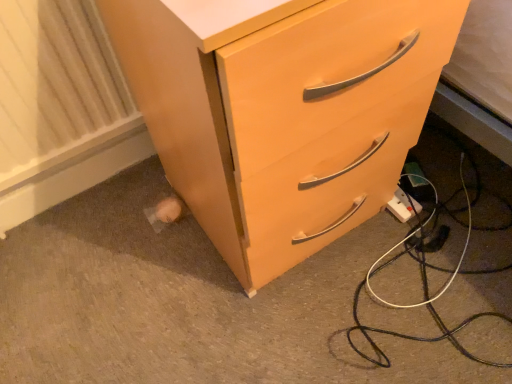
The image size is (512, 384). Describe the element at coordinates (282, 111) in the screenshot. I see `matte wood chest of drawers at center` at that location.

Image resolution: width=512 pixels, height=384 pixels. Find the location of `matte wood chest of drawers at center`. matte wood chest of drawers at center is located at coordinates (282, 111).

This screenshot has height=384, width=512. What are the coordinates of `white plastic power strip at lower right` in the screenshot? It's located at (403, 206).

Consider the image. Is white plastic power strip at lower right facing away from matte wood chest of drawers at center?

No.

Based on the photo, from a real-world perspective, who is located lower, white plastic power strip at lower right or matte wood chest of drawers at center?

white plastic power strip at lower right is physically lower.

Which object is positioned more to the left, white plastic power strip at lower right or matte wood chest of drawers at center?

matte wood chest of drawers at center is more to the left.

Does point (405, 197) lie in front of point (333, 14)?

No, (405, 197) is further to viewer.

Could you tell me if matte wood chest of drawers at center is facing white plastic power strip at lower right?

No.

Can you tell me how much matte wood chest of drawers at center and white plastic power strip at lower right differ in facing direction?

They differ by 0.0619 degrees in their facing directions.

Does matte wood chest of drawers at center lie behind white plastic power strip at lower right?

No, it is not.

Would you say white textured radiator at lower left is to the left or to the right of white plastic power strip at lower right in the picture?

Based on their positions, white textured radiator at lower left is located to the left of white plastic power strip at lower right.

Who is more distant, white textured radiator at lower left or white plastic power strip at lower right?

white plastic power strip at lower right is further from the camera.

Are white textured radiator at lower left and white plastic power strip at lower right beside each other?

No, white textured radiator at lower left is not in contact with white plastic power strip at lower right.

Is the surface of white textured radiator at lower left in direct contact with matte wood chest of drawers at center?

No, white textured radiator at lower left is not beside matte wood chest of drawers at center.

Consider the image. Does white textured radiator at lower left appear on the left side of matte wood chest of drawers at center?

Yes.

In the scene shown: Is matte wood chest of drawers at center located within white textured radiator at lower left?

No, matte wood chest of drawers at center is located outside of white textured radiator at lower left.

From the image's perspective, is white textured radiator at lower left located above or below matte wood chest of drawers at center?

white textured radiator at lower left is below matte wood chest of drawers at center.

Is matte wood chest of drawers at center in contact with white textured radiator at lower left?

No, matte wood chest of drawers at center is not making contact with white textured radiator at lower left.

Is matte wood chest of drawers at center spatially inside white textured radiator at lower left, or outside of it?

matte wood chest of drawers at center is outside white textured radiator at lower left.

From a real-world perspective, is matte wood chest of drawers at center physically above white textured radiator at lower left?

Yes, from a real-world perspective, matte wood chest of drawers at center is over white textured radiator at lower left

From the picture: Are white plastic power strip at lower right and white textured radiator at lower left beside each other?

They are not placed beside each other.

Considering the relative positions of white plastic power strip at lower right and white textured radiator at lower left in the image provided, is white plastic power strip at lower right to the left or to the right of white textured radiator at lower left?

In the image, white plastic power strip at lower right appears on the right side of white textured radiator at lower left.

Considering the points (415, 205) and (49, 42), which point is behind, point (415, 205) or point (49, 42)?

The point (415, 205) is more distant.

Find the location of `chest of drawers to the left of white plastic power strip at lower right`. chest of drawers to the left of white plastic power strip at lower right is located at coordinates (282, 111).

The height and width of the screenshot is (384, 512). Identify the location of electric outlet located underneath the matte wood chest of drawers at center (from a real-world perspective). (403, 206).

Considering their positions, is white textured radiator at lower left positioned closer to matte wood chest of drawers at center than white plastic power strip at lower right?

Based on the image, white textured radiator at lower left appears to be nearer to matte wood chest of drawers at center.

Estimate the real-world distances between objects in this image. Which object is closer to white plastic power strip at lower right, matte wood chest of drawers at center or white textured radiator at lower left?

matte wood chest of drawers at center.

Estimate the real-world distances between objects in this image. Which object is further from matte wood chest of drawers at center, white plastic power strip at lower right or white textured radiator at lower left?

white plastic power strip at lower right lies further to matte wood chest of drawers at center than the other object.

Estimate the real-world distances between objects in this image. Which object is closer to white textured radiator at lower left, white plastic power strip at lower right or matte wood chest of drawers at center?

matte wood chest of drawers at center is closer to white textured radiator at lower left.

From the image, which object appears to be nearer to white textured radiator at lower left, matte wood chest of drawers at center or white plastic power strip at lower right?

Among the two, matte wood chest of drawers at center is located nearer to white textured radiator at lower left.

When comparing their distances from white plastic power strip at lower right, does white textured radiator at lower left or matte wood chest of drawers at center seem further?

The object further to white plastic power strip at lower right is white textured radiator at lower left.

Identify the location of the chest of drawers located between white textured radiator at lower left and white plastic power strip at lower right in the left-right direction. (282, 111).